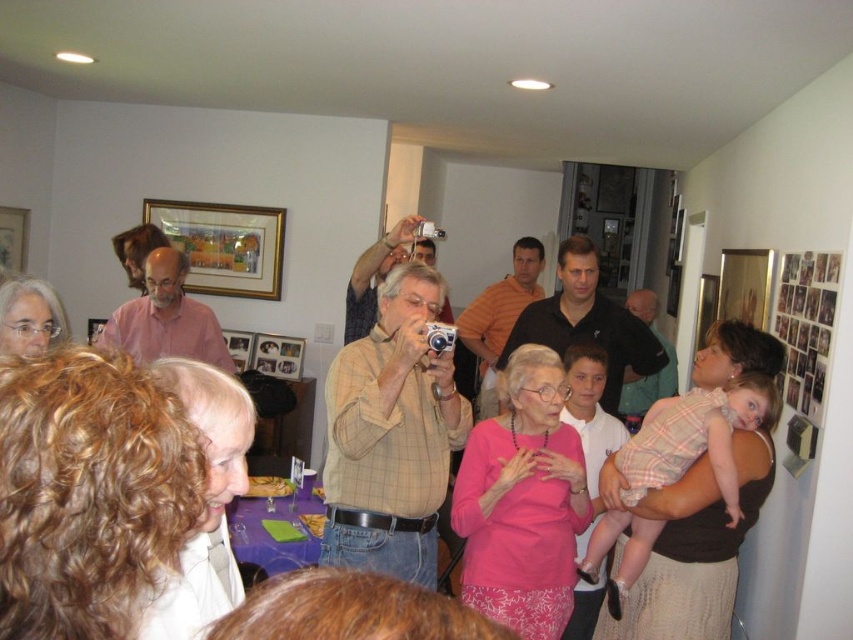
Does matte pink blouse at center appear over matte brown shirt at center?

No, matte pink blouse at center is not above matte brown shirt at center.

Can you confirm if matte pink blouse at center is thinner than matte brown shirt at center?

Correct, matte pink blouse at center's width is less than matte brown shirt at center's.

Looking at this image, who is more distant from viewer, (688,531) or (637,378)?

Point (637,378)

The height and width of the screenshot is (640, 853). In order to click on matte pink blouse at center in this screenshot , I will do `click(708, 508)`.

Does pink shirt at center appear over orange shirt at center?

Correct, pink shirt at center is located above orange shirt at center.

Between pink shirt at center and orange shirt at center, which one has less height?

Standing shorter between the two is pink shirt at center.

Does point (125, 308) come farther from viewer compared to point (468, 321)?

No, it is in front of (468, 321).

You are a GUI agent. You are given a task and a screenshot of the screen. Output one action in this format:
    pyautogui.click(x=<x>, y=<y>)
    Task: Click on the pink shirt at center
    This screenshot has height=640, width=853.
    Given the screenshot: What is the action you would take?
    pyautogui.click(x=166, y=317)

Is white shirt at lower left taller than pink shirt at center?

No.

Between white shirt at lower left and pink shirt at center, which one has more height?

Standing taller between the two is pink shirt at center.

The image size is (853, 640). In order to click on white shirt at lower left in this screenshot , I will do `click(206, 500)`.